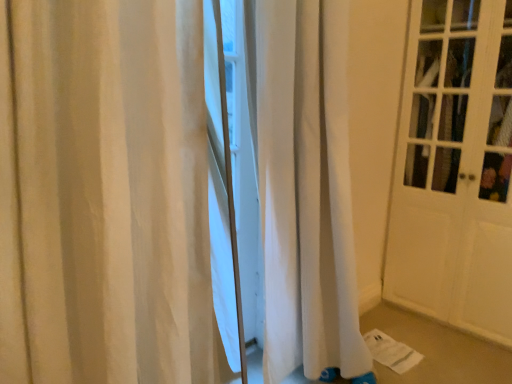
Find the location of a particular element. white fabric curtain at center is located at coordinates (105, 194).

Measure the distance between point (89,159) and camera.

Point (89,159) and camera are 34.02 inches apart from each other.

The image size is (512, 384). What do you see at coordinates (105, 194) in the screenshot? I see `white fabric curtain at center` at bounding box center [105, 194].

The image size is (512, 384). Describe the element at coordinates (455, 169) in the screenshot. I see `white wood door at right` at that location.

You are a GUI agent. You are given a task and a screenshot of the screen. Output one action in this format:
    pyautogui.click(x=<x>, y=<y>)
    Task: Click on the white wood door at right
    
    Given the screenshot: What is the action you would take?
    pyautogui.click(x=455, y=169)

Where is `white fabric curtain at center`? white fabric curtain at center is located at coordinates (105, 194).

Which object is positioned more to the left, white fabric curtain at center or white wood door at right?

Positioned to the left is white fabric curtain at center.

Which is in front, white fabric curtain at center or white wood door at right?

white fabric curtain at center.

In the scene shown: Which point is more distant from viewer, (117,9) or (447,136)?

The point (447,136) is farther from the camera.

From the image's perspective, which is below, white fabric curtain at center or white wood door at right?

white fabric curtain at center, from the image's perspective.

From a real-world perspective, is white fabric curtain at center on top of white wood door at right?

Incorrect, from a real-world perspective, white fabric curtain at center is lower than white wood door at right.

Which object is thinner, white fabric curtain at center or white wood door at right?

With smaller width is white fabric curtain at center.

In the scene shown: From their relative heights in the image, would you say white fabric curtain at center is taller or shorter than white wood door at right?

Clearly, white fabric curtain at center is shorter compared to white wood door at right.

Considering the sizes of objects white fabric curtain at center and white wood door at right in the image provided, who is smaller, white fabric curtain at center or white wood door at right?

Smaller between the two is white fabric curtain at center.

Do you think white fabric curtain at center is within white wood door at right, or outside of it?

white fabric curtain at center lies outside white wood door at right.

Is white fabric curtain at center next to white wood door at right?

white fabric curtain at center and white wood door at right are not in contact.

Is white fabric curtain at center oriented towards white wood door at right?

No, white fabric curtain at center is not oriented towards white wood door at right.

How different are the orientations of white fabric curtain at center and white wood door at right in degrees?

91.2 degrees separate the facing orientations of white fabric curtain at center and white wood door at right.

At what (x,y) coordinates should I click in order to perform the action: click on door positioned vertically above the white fabric curtain at center (from a real-world perspective). Please return your answer as a coordinate pair (x, y). This screenshot has width=512, height=384. Looking at the image, I should click on (455, 169).

Can you confirm if white wood door at right is positioned to the left of white fabric curtain at center?

No, white wood door at right is not to the left of white fabric curtain at center.

Considering their positions, is white wood door at right located in front of or behind white fabric curtain at center?

Visually, white wood door at right is located behind white fabric curtain at center.

Which is less distant, (x=392, y=243) or (x=296, y=292)?

Positioned in front is point (x=296, y=292).

From the image's perspective, between white wood door at right and white fabric curtain at center, who is located below?

white fabric curtain at center, from the image's perspective.

From a real-world perspective, relative to white fabric curtain at center, is white wood door at right vertically above or below?

In terms of real-world spatial position, white wood door at right is above white fabric curtain at center.

Does white wood door at right have a lesser width compared to white fabric curtain at center?

No, white wood door at right is not thinner than white fabric curtain at center.

Is white wood door at right shorter than white fabric curtain at center?

No, white wood door at right is not shorter than white fabric curtain at center.

Is white wood door at right smaller than white fabric curtain at center?

Incorrect, white wood door at right is not smaller in size than white fabric curtain at center.

Can we say white wood door at right lies outside white fabric curtain at center?

Yes, white wood door at right is outside of white fabric curtain at center.

Based on the photo, would you say white wood door at right is a long distance from white fabric curtain at center?

Yes.

Is white wood door at right oriented away from white fabric curtain at center?

No.

Can you tell me how much white wood door at right and white fabric curtain at center differ in facing direction?

The angular difference between white wood door at right and white fabric curtain at center is 91.2 degrees.

Measure the distance between white wood door at right and white fabric curtain at center.

The distance of white wood door at right from white fabric curtain at center is 5.16 feet.

You are a GUI agent. You are given a task and a screenshot of the screen. Output one action in this format:
    pyautogui.click(x=<x>, y=<y>)
    Task: Click on the door above the white fabric curtain at center (from the image's perspective)
    
    Given the screenshot: What is the action you would take?
    coord(455,169)

Where is `door on the right of white fabric curtain at center`? door on the right of white fabric curtain at center is located at coordinates coord(455,169).

Image resolution: width=512 pixels, height=384 pixels. In order to click on curtain lying in front of the white wood door at right in this screenshot , I will do `click(105, 194)`.